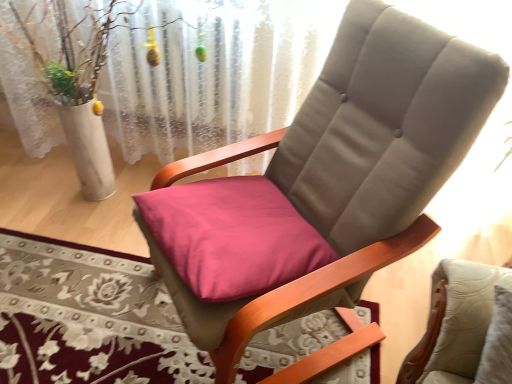
The image size is (512, 384). What are the coordinates of `blank area beneath suede-like beige chair at center (from a real-world perspective)` in the screenshot? It's located at (295, 350).